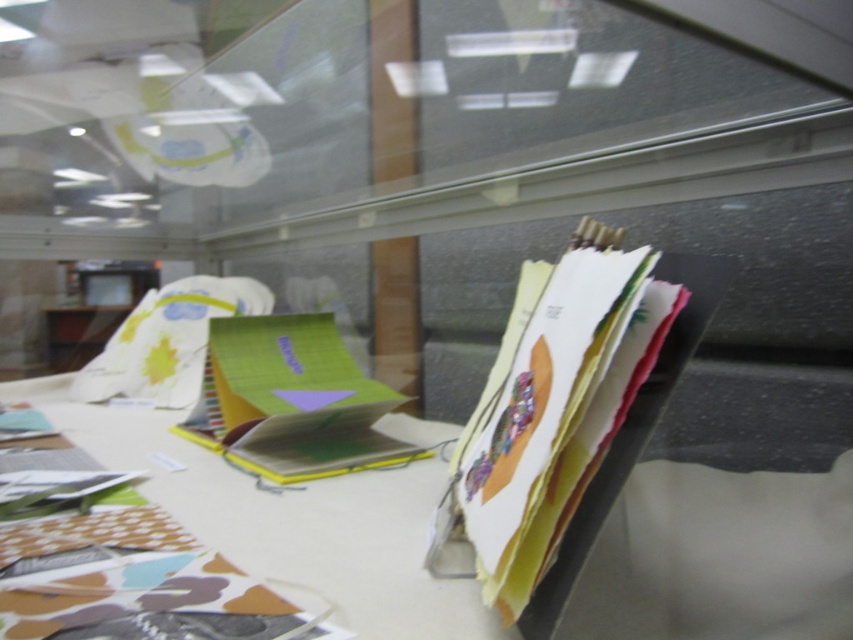
You are organizing the workspace and need to place a new item on the widest surface between the matte paper table at center and the matte paper stack at right. Which surface should you choose?

The matte paper table at center is wider than the matte paper stack at right, so you should place the new item on the matte paper table at center.

In the scene shown: You are organizing your workspace and need to move a small 10 inch wide box from the matte paper table at center to the matte paper stack at right. Can the box fit between them without overlapping?

The distance between the matte paper table at center and the matte paper stack at right is 11.57 inches. Since the box is only 10 inches wide, it can fit between them without overlapping.